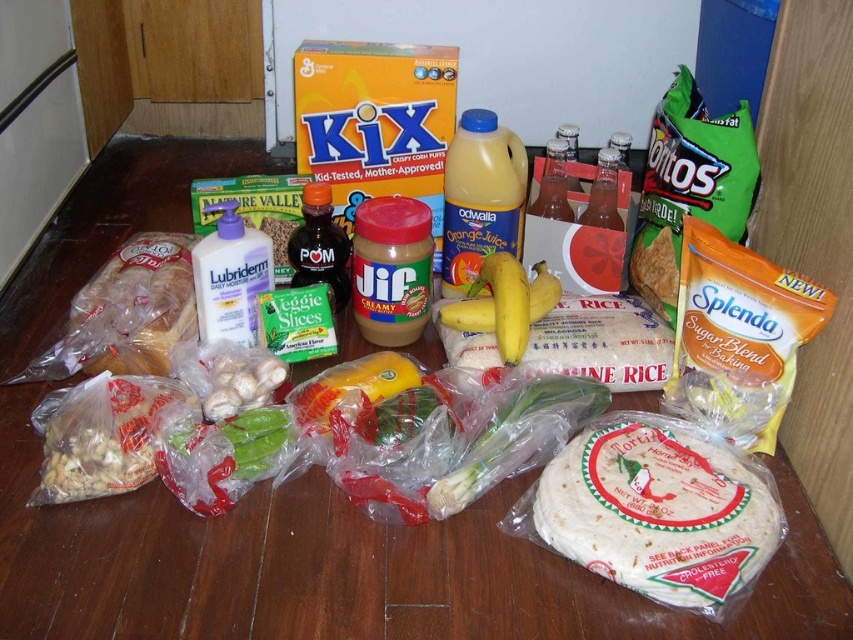
Does point (683, 493) come closer to viewer compared to point (498, 212)?

Yes.

Between point (746, 484) and point (482, 243), which one is positioned in front?

Point (746, 484) is in front.

Locate an element on the screen. The image size is (853, 640). white paper tortilla at lower right is located at coordinates (660, 509).

Does yellow translucent bottle at center have a lesser width compared to creamy peanut butter at center?

No, yellow translucent bottle at center is not thinner than creamy peanut butter at center.

Can you confirm if yellow translucent bottle at center is smaller than creamy peanut butter at center?

Incorrect, yellow translucent bottle at center is not smaller in size than creamy peanut butter at center.

This screenshot has width=853, height=640. I want to click on yellow translucent bottle at center, so [480, 196].

Does white paper tortilla at lower right appear over creamy peanut butter at center?

No.

Looking at this image, between white paper tortilla at lower right and creamy peanut butter at center, which one appears on the right side from the viewer's perspective?

Positioned to the right is white paper tortilla at lower right.

Describe the element at coordinates (660, 509) in the screenshot. I see `white paper tortilla at lower right` at that location.

Locate an element on the screen. The image size is (853, 640). white paper tortilla at lower right is located at coordinates (660, 509).